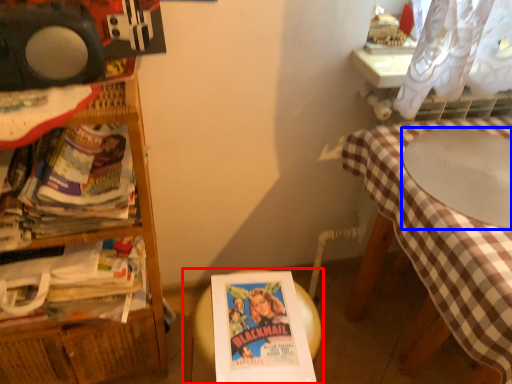
Question: Which object appears closest to the camera in this image, table (highlighted by a red box) or round table (highlighted by a blue box)?

Choices:
 (A) table
 (B) round table

Answer: (B)